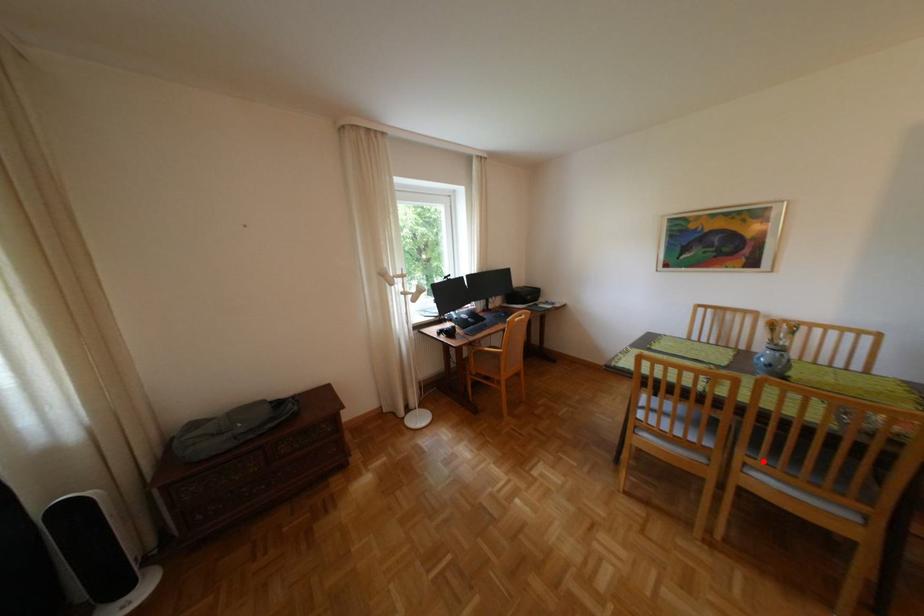
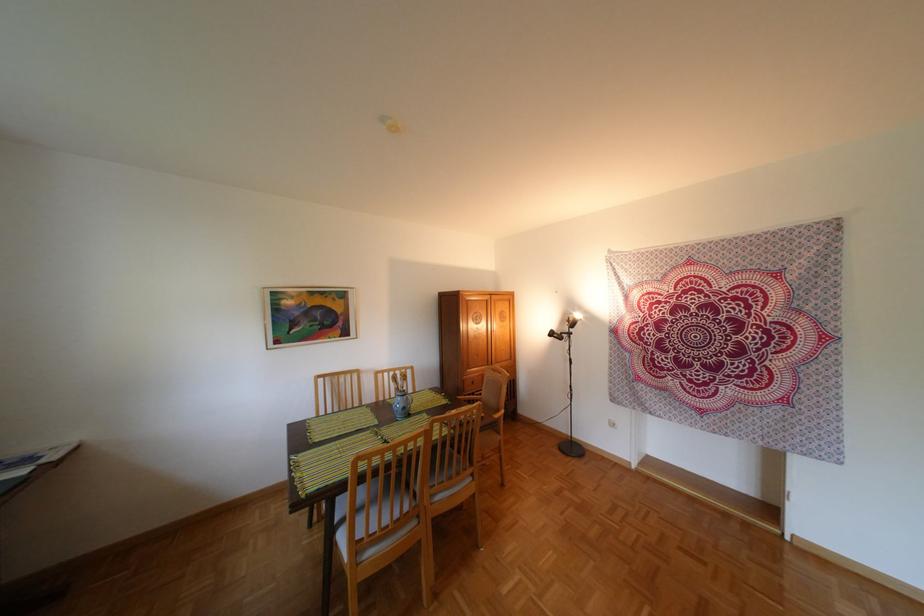
Find the pixel in the second image that matches the highlighted location in the first image.

(445, 491)